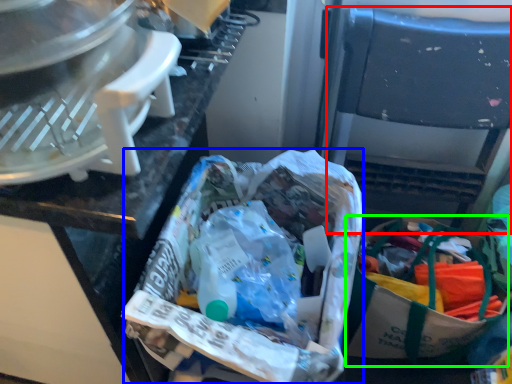
Question: Which is farther away from folding chair (highlighted by a red box)? material (highlighted by a blue box) or shopping bag (highlighted by a green box)?

Choices:
 (A) material
 (B) shopping bag

Answer: (A)